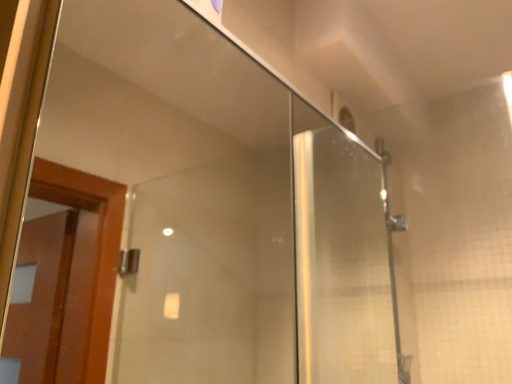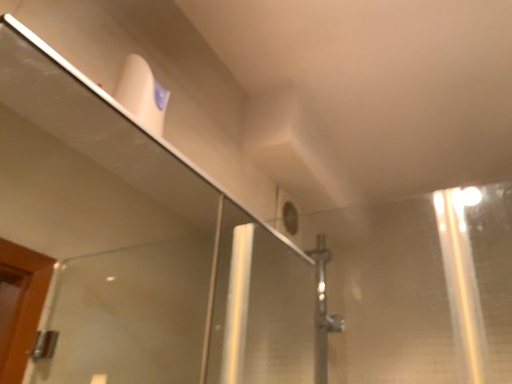
Question: How did the camera likely rotate when shooting the video?

Choices:
 (A) rotated left
 (B) rotated right

Answer: (B)